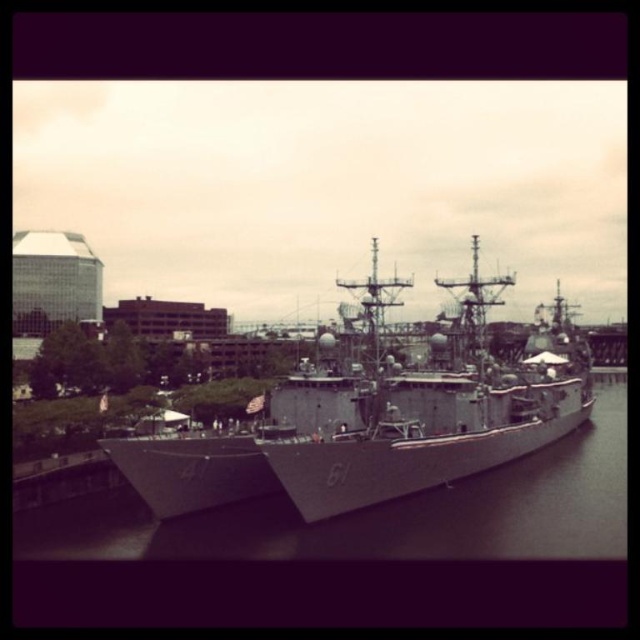
You are a drone operator trying to navigate between two points in the scene. The first point is point [586,397] and the second is point [528,557]. Which point is closer to the naval ships docked in the waterfront scene?

Point [528,557] is closer to the naval ships docked in the waterfront scene because it is in front of point [586,397].

You are a photographer positioned on the dock and want to capture both the gray metallic ship at center and the gray metallic water at center in a single frame. Based on their positions, which object should you adjust your camera to focus on first to ensure both are in the shot?

Since the gray metallic ship at center is to the right of gray metallic water at center, you should focus on the gray metallic ship at center first to ensure both are included in the frame.

Based on the photo, you are a naval engineer tasked with ensuring safe passage between two naval ships docked side by side. The ships are located at point coordinates point(572, 381). What is the minimum distance you need to maintain between them to prevent collision?

The minimum distance to maintain between the two naval ships docked at point(572, 381) is 582.67 feet to prevent collision.